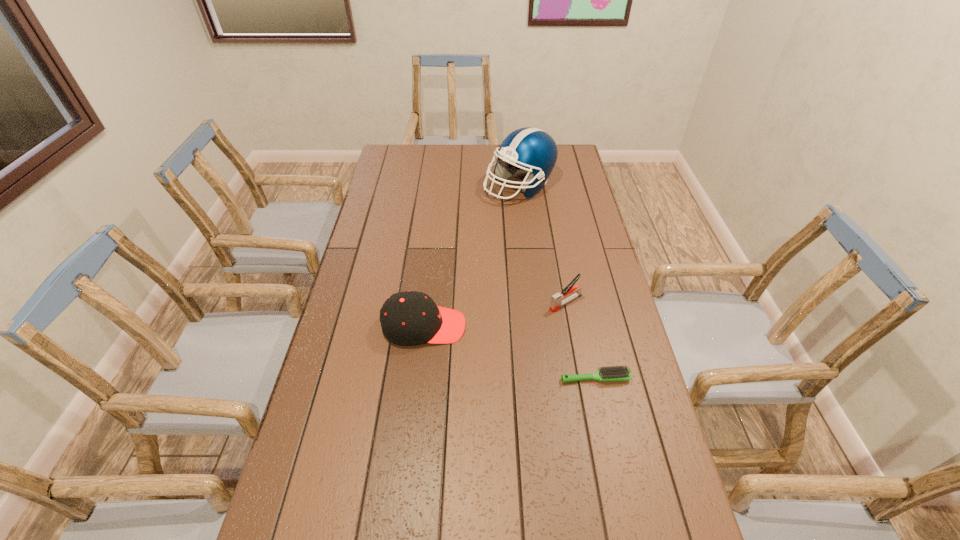
Where is `vacant space that is in between the nearest object and the stapler`? The height and width of the screenshot is (540, 960). vacant space that is in between the nearest object and the stapler is located at coordinates (581, 340).

Where is `free space that is in between the farthest object and the hairbrush`? This screenshot has width=960, height=540. free space that is in between the farthest object and the hairbrush is located at coordinates (558, 282).

The image size is (960, 540). What are the coordinates of `free space between the stapler and the shortest object` in the screenshot? It's located at (581, 340).

Locate an element on the screen. The height and width of the screenshot is (540, 960). object that can be found as the second closest to the stapler is located at coordinates (407, 318).

Identify which object is located as the second nearest to the tallest object. Please provide its 2D coordinates. Your answer should be formatted as a tuple, i.e. [(x, y)], where the tuple contains the x and y coordinates of a point satisfying the conditions above.

[(407, 318)]

At what (x,y) coordinates should I click in order to perform the action: click on free space that satisfies the following two spatial constraints: 1. on the front side of the stapler; 2. on the right side of the hairbrush. Please return your answer as a coordinate pair (x, y). The height and width of the screenshot is (540, 960). Looking at the image, I should click on (580, 377).